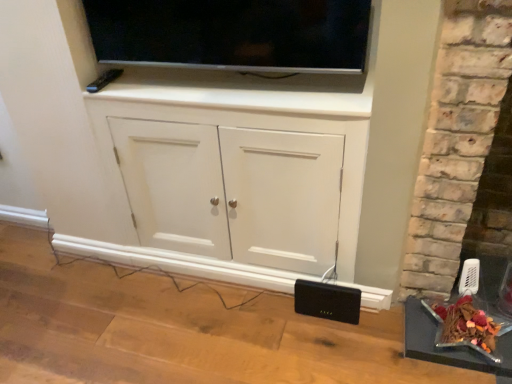
The image size is (512, 384). Find the location of `white matte cabinet at center`. white matte cabinet at center is located at coordinates (239, 182).

This screenshot has width=512, height=384. What do you see at coordinates (327, 301) in the screenshot? I see `black plastic speaker at lower right` at bounding box center [327, 301].

Image resolution: width=512 pixels, height=384 pixels. What do you see at coordinates (446, 347) in the screenshot?
I see `metallic silver tray at lower right` at bounding box center [446, 347].

What is the approximate height of matte black tv at upper center?

The height of matte black tv at upper center is 12.56 inches.

This screenshot has height=384, width=512. What do you see at coordinates (232, 34) in the screenshot?
I see `matte black tv at upper center` at bounding box center [232, 34].

This screenshot has width=512, height=384. Find the location of `white matte cabinet at center`. white matte cabinet at center is located at coordinates (239, 182).

Is white matte cabinet at center to the right of black plastic speaker at lower right from the viewer's perspective?

No.

Who is taller, white matte cabinet at center or black plastic speaker at lower right?

Standing taller between the two is white matte cabinet at center.

How different are the orientations of white matte cabinet at center and black plastic speaker at lower right in degrees?

There is a 0.214-degree angle between the facing directions of white matte cabinet at center and black plastic speaker at lower right.

Considering the relative sizes of white matte cabinet at center and matte black tv at upper center in the image provided, is white matte cabinet at center shorter than matte black tv at upper center?

No, white matte cabinet at center is not shorter than matte black tv at upper center.

Is white matte cabinet at center inside or outside of matte black tv at upper center?

white matte cabinet at center cannot be found inside matte black tv at upper center.

From a real-world perspective, which is physically below, white matte cabinet at center or matte black tv at upper center?

white matte cabinet at center is physically lower.

Are matte black tv at upper center and white matte cabinet at center located far from each other?

No.

How many degrees apart are the facing directions of matte black tv at upper center and white matte cabinet at center?

matte black tv at upper center and white matte cabinet at center are facing 0.000217 degrees away from each other.

From the image's perspective, which is below, matte black tv at upper center or white matte cabinet at center?

white matte cabinet at center.

The image size is (512, 384). I want to click on cabinetry that is on the right side of matte black tv at upper center, so click(239, 182).

Is white matte cabinet at center outside of metallic silver tray at lower right?

Absolutely, white matte cabinet at center is external to metallic silver tray at lower right.

Does white matte cabinet at center lie in front of metallic silver tray at lower right?

That is True.

This screenshot has width=512, height=384. In order to click on table below the white matte cabinet at center (from a real-world perspective) in this screenshot , I will do `click(446, 347)`.

Considering the relative positions of white matte cabinet at center and metallic silver tray at lower right in the image provided, is white matte cabinet at center to the right of metallic silver tray at lower right from the viewer's perspective?

Incorrect, white matte cabinet at center is not on the right side of metallic silver tray at lower right.

Considering the sizes of objects metallic silver tray at lower right and matte black tv at upper center in the image provided, who is wider, metallic silver tray at lower right or matte black tv at upper center?

metallic silver tray at lower right.

Which object is more forward, metallic silver tray at lower right or matte black tv at upper center?

matte black tv at upper center is closer to the camera.

Considering the sizes of metallic silver tray at lower right and matte black tv at upper center in the image, is metallic silver tray at lower right bigger or smaller than matte black tv at upper center?

metallic silver tray at lower right is smaller than matte black tv at upper center.

How different are the orientations of metallic silver tray at lower right and matte black tv at upper center in degrees?

The facing directions of metallic silver tray at lower right and matte black tv at upper center are 4.36 degrees apart.

Considering the relative positions of matte black tv at upper center and black plastic speaker at lower right in the image provided, is matte black tv at upper center to the right of black plastic speaker at lower right from the viewer's perspective?

No.

Considering the positions of objects matte black tv at upper center and black plastic speaker at lower right in the image provided, who is in front, matte black tv at upper center or black plastic speaker at lower right?

Positioned in front is matte black tv at upper center.

The width and height of the screenshot is (512, 384). Identify the location of speaker beneath the matte black tv at upper center (from a real-world perspective). (327, 301).

Is black plastic speaker at lower right spatially inside metallic silver tray at lower right, or outside of it?

black plastic speaker at lower right is not enclosed by metallic silver tray at lower right.

The height and width of the screenshot is (384, 512). What are the coordinates of `table that appears on the right of black plastic speaker at lower right` in the screenshot? It's located at (446, 347).

Is black plastic speaker at lower right turned away from metallic silver tray at lower right?

black plastic speaker at lower right is not turned away from metallic silver tray at lower right.

Locate an element on the screen. speaker that appears below the white matte cabinet at center (from the image's perspective) is located at coordinates (327, 301).

Where is `cabinetry behind the matte black tv at upper center`? Image resolution: width=512 pixels, height=384 pixels. cabinetry behind the matte black tv at upper center is located at coordinates (239, 182).

Based on their spatial positions, is matte black tv at upper center or white matte cabinet at center closer to black plastic speaker at lower right?

white matte cabinet at center is positioned closer to the anchor black plastic speaker at lower right.

Based on the photo, estimate the real-world distances between objects in this image. Which object is further from matte black tv at upper center, white matte cabinet at center or black plastic speaker at lower right?

Based on the image, black plastic speaker at lower right appears to be further to matte black tv at upper center.

From the image, which object appears to be nearer to matte black tv at upper center, white matte cabinet at center or metallic silver tray at lower right?

white matte cabinet at center is closer to matte black tv at upper center.

Estimate the real-world distances between objects in this image. Which object is further from metallic silver tray at lower right, white matte cabinet at center or matte black tv at upper center?

matte black tv at upper center is positioned further to the anchor metallic silver tray at lower right.

Estimate the real-world distances between objects in this image. Which object is further from matte black tv at upper center, metallic silver tray at lower right or black plastic speaker at lower right?

Among the two, metallic silver tray at lower right is located further to matte black tv at upper center.

From the image, which object appears to be nearer to black plastic speaker at lower right, metallic silver tray at lower right or matte black tv at upper center?

Among the two, metallic silver tray at lower right is located nearer to black plastic speaker at lower right.

Looking at the image, which one is located closer to black plastic speaker at lower right, matte black tv at upper center or metallic silver tray at lower right?

Among the two, metallic silver tray at lower right is located nearer to black plastic speaker at lower right.

Consider the image. From the image, which object appears to be nearer to metallic silver tray at lower right, black plastic speaker at lower right or matte black tv at upper center?

The object closer to metallic silver tray at lower right is black plastic speaker at lower right.

Locate an element on the screen. cabinetry between matte black tv at upper center and black plastic speaker at lower right in the vertical direction is located at coordinates (239, 182).

What are the coordinates of `cabinetry between matte black tv at upper center and metallic silver tray at lower right from left to right` in the screenshot? It's located at (239, 182).

Where is `speaker between white matte cabinet at center and metallic silver tray at lower right from left to right`? This screenshot has height=384, width=512. speaker between white matte cabinet at center and metallic silver tray at lower right from left to right is located at coordinates (327, 301).

You are a GUI agent. You are given a task and a screenshot of the screen. Output one action in this format:
    pyautogui.click(x=<x>, y=<y>)
    Task: Click on the speaker between matte black tv at upper center and metallic silver tray at lower right vertically
    This screenshot has width=512, height=384.
    Given the screenshot: What is the action you would take?
    pyautogui.click(x=327, y=301)